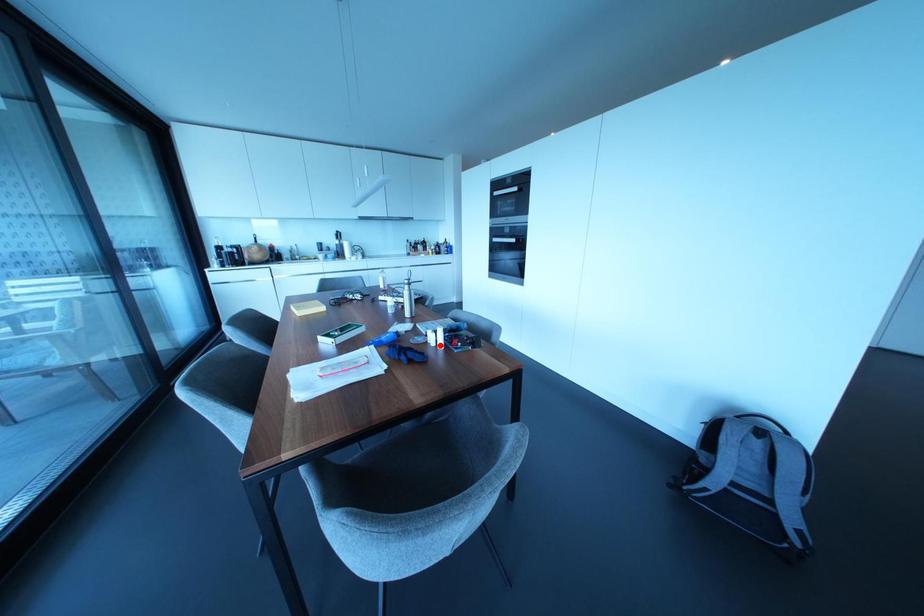
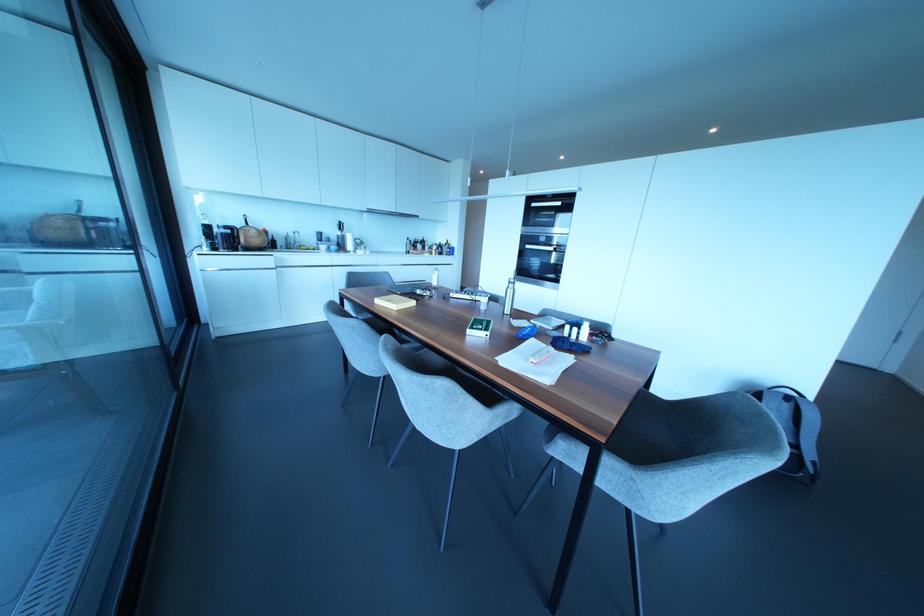
Locate, in the second image, the point that corresponds to the highlighted location in the first image.

(584, 338)